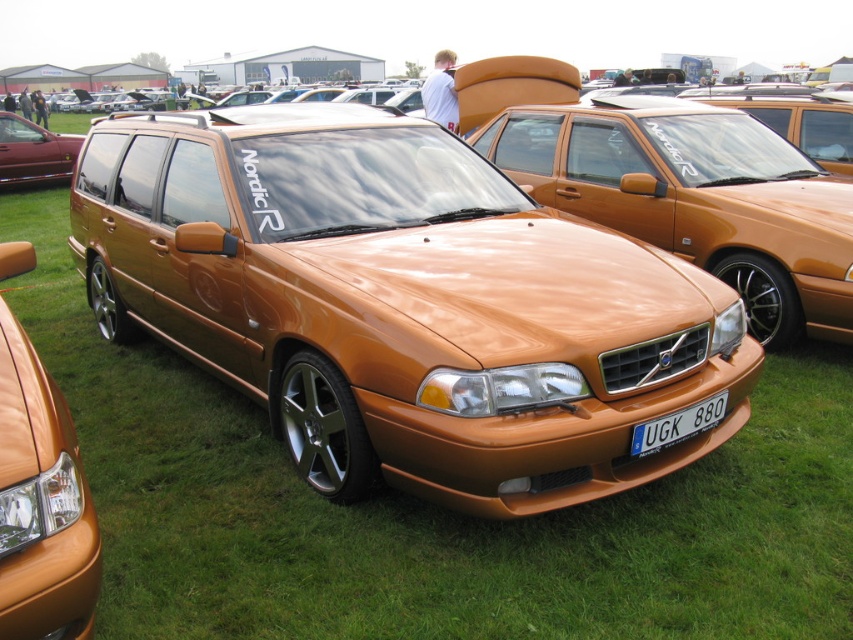
Question: Which point is closer to the camera taking this photo?

Choices:
 (A) (694, 406)
 (B) (25, 164)
 (C) (757, 260)
 (D) (45, 525)

Answer: (D)

Question: In this image, where is matte orange sedan at center located relative to white plastic license plate at center?

Choices:
 (A) below
 (B) above

Answer: (B)

Question: Which object is the closest to the matte orange sedan at center?

Choices:
 (A) metallic gold sedan at center
 (B) white plastic license plate at center
 (C) metallic red sedan at left

Answer: (B)

Question: Does metallic gold sedan at center have a greater width compared to metallic red sedan at left?

Choices:
 (A) yes
 (B) no

Answer: (A)

Question: Estimate the real-world distances between objects in this image. Which object is farther from the white plastic license plate at center?

Choices:
 (A) matte orange sedan at center
 (B) metallic red sedan at left

Answer: (B)

Question: Is metallic gold sedan at center thinner than matte orange sedan at center?

Choices:
 (A) yes
 (B) no

Answer: (B)